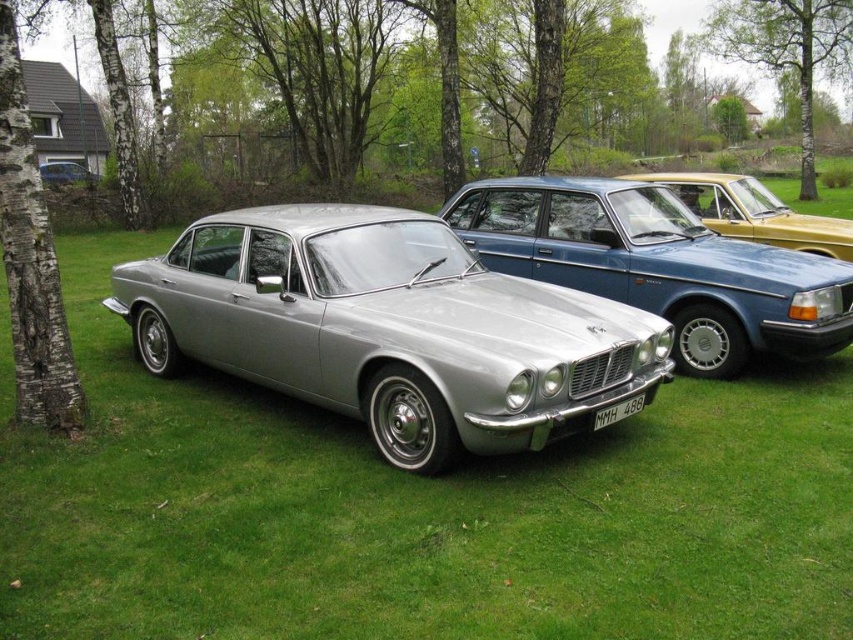
Question: Is metallic silver car at left positioned at the back of white plastic license plate at center?

Choices:
 (A) no
 (B) yes

Answer: (B)

Question: Which object is positioned farthest from the metallic silver car at left?

Choices:
 (A) bark textured tree at upper center
 (B) white plastic license plate at center
 (C) silver metallic car at center

Answer: (A)

Question: Does silver metallic car at center have a greater width compared to metallic gold car at center?

Choices:
 (A) no
 (B) yes

Answer: (A)

Question: Which object is the farthest from the silver metallic car at center?

Choices:
 (A) metallic silver car at left
 (B) metallic gold car at center
 (C) bark textured tree at upper center
 (D) bark textured tree at left

Answer: (C)

Question: Does satin silver car at center have a greater width compared to bark textured tree at upper center?

Choices:
 (A) yes
 (B) no

Answer: (B)

Question: Which point appears farthest from the camera in this image?

Choices:
 (A) (639, 404)
 (B) (196, 227)

Answer: (B)